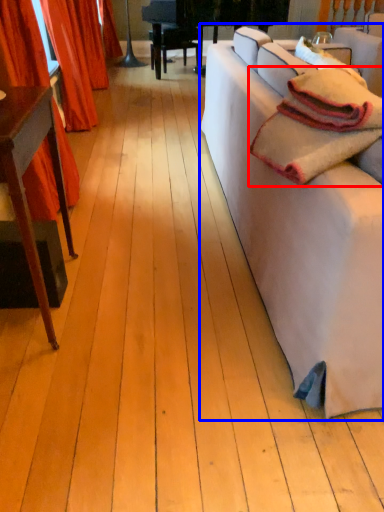
Question: Among these objects, which one is nearest to the camera, blanket (highlighted by a red box) or studio couch (highlighted by a blue box)?

Choices:
 (A) blanket
 (B) studio couch

Answer: (B)